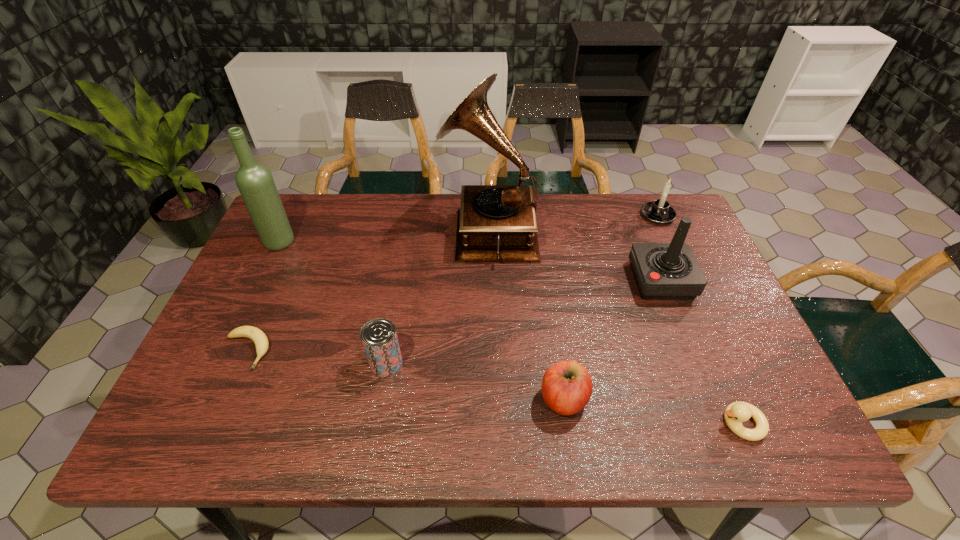
Locate an element on the screen. The height and width of the screenshot is (540, 960). vacant region at the near left corner of the desktop is located at coordinates (189, 420).

This screenshot has height=540, width=960. Find the location of `free spot between the record player and the apple`. free spot between the record player and the apple is located at coordinates (526, 314).

The image size is (960, 540). Find the location of `blank region between the beer can and the wine bottle`. blank region between the beer can and the wine bottle is located at coordinates (333, 302).

The image size is (960, 540). Identify the location of vacant area that lies between the apple and the tallest object. click(526, 314).

The width and height of the screenshot is (960, 540). Identify the location of free space between the apple and the record player. (526, 314).

The height and width of the screenshot is (540, 960). Identify the location of empty location between the joystick and the sixth object from right to left. (523, 322).

Image resolution: width=960 pixels, height=540 pixels. I want to click on vacant space that is in between the tallest object and the banana, so click(x=368, y=290).

I want to click on unoccupied area between the shortest object and the wine bottle, so click(x=263, y=296).

What are the coordinates of `object identified as the seventh closest to the candle holder` in the screenshot? It's located at (259, 338).

Identify the location of the second closest object to the duckling. The image size is (960, 540). (663, 271).